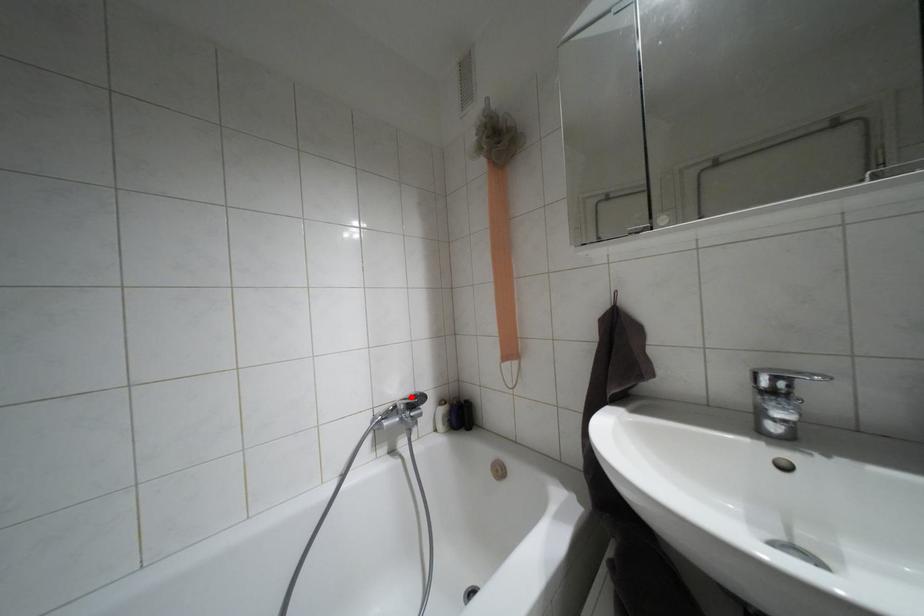
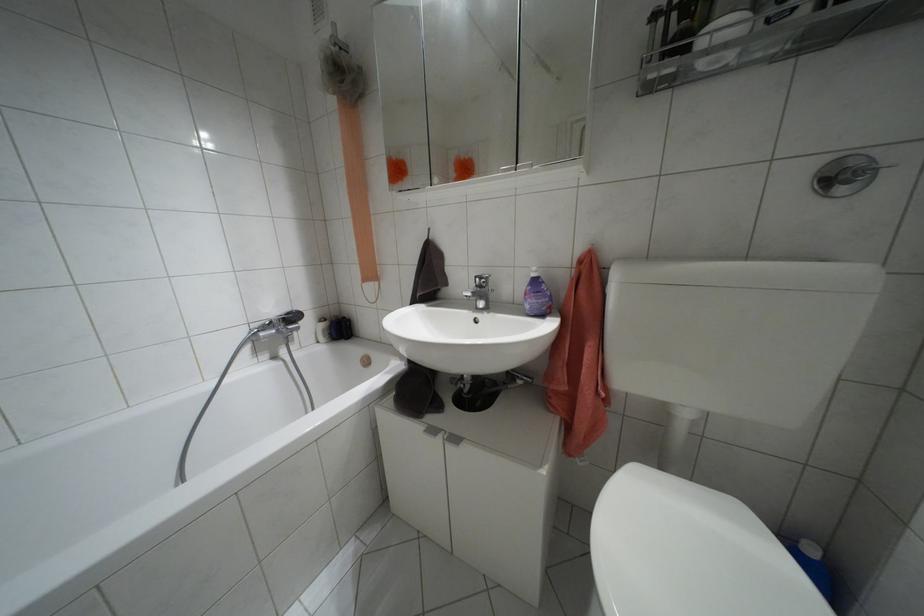
Locate, in the second image, the point that corresponds to the highlighted location in the first image.

(286, 313)